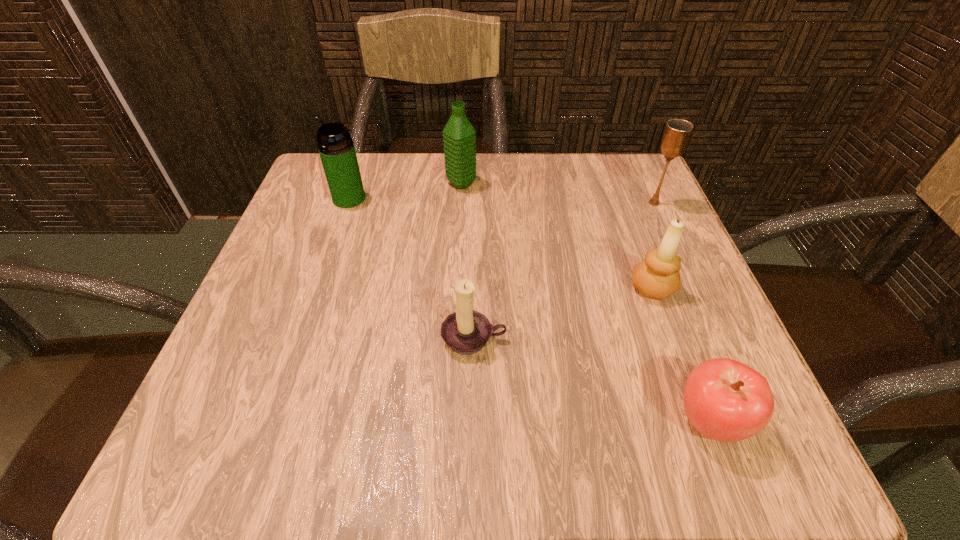
This screenshot has height=540, width=960. I want to click on apple that is at the right edge, so click(725, 400).

This screenshot has width=960, height=540. In order to click on object present at the far left corner in this screenshot , I will do `click(336, 148)`.

Locate an element on the screen. The height and width of the screenshot is (540, 960). object that is at the far right corner is located at coordinates (x=677, y=133).

Locate an element on the screen. This screenshot has width=960, height=540. object located in the near right corner section of the desktop is located at coordinates (725, 400).

The image size is (960, 540). Identify the location of vacant space at the far edge of the desktop. (478, 160).

The image size is (960, 540). In the image, there is a desktop. In order to click on free region at the near edge in this screenshot , I will do `click(488, 407)`.

What are the coordinates of `free point at the left edge` in the screenshot? It's located at (319, 297).

The width and height of the screenshot is (960, 540). In the image, there is a desktop. In order to click on vacant space at the right edge in this screenshot , I will do `click(688, 282)`.

Locate an element on the screen. free region at the far left corner of the desktop is located at coordinates (301, 206).

In the image, there is a desktop. Identify the location of vacant area at the far right corner. Image resolution: width=960 pixels, height=540 pixels. (598, 211).